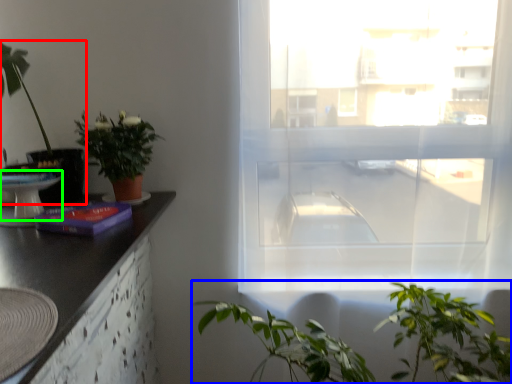
Question: Based on their relative distances, which object is nearer to houseplant (highlighted by a red box)? Choose from vegetation (highlighted by a blue box) and round table (highlighted by a green box).

Choices:
 (A) vegetation
 (B) round table

Answer: (B)